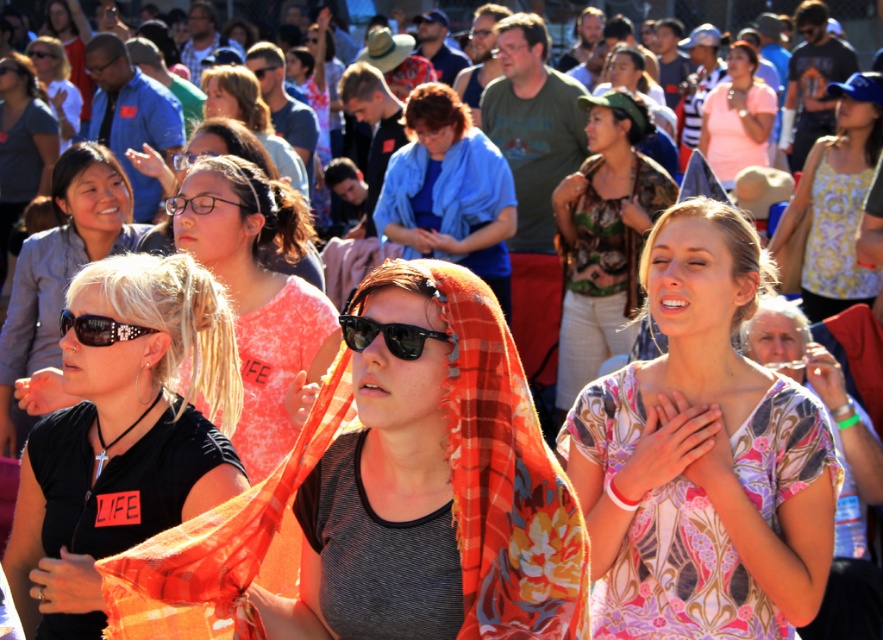
Is pink fabric headscarf at center closer to camera compared to black plastic sunglasses at left?

No, pink fabric headscarf at center is behind black plastic sunglasses at left.

Identify the location of pink fabric headscarf at center. This screenshot has height=640, width=883. (736, 116).

At what (x,y) coordinates should I click in order to perform the action: click on pink fabric headscarf at center. Please return your answer as a coordinate pair (x, y). Image resolution: width=883 pixels, height=640 pixels. Looking at the image, I should click on (736, 116).

Is pink fabric scarf at center bigger than black plastic sunglasses at center?

Yes, pink fabric scarf at center is bigger than black plastic sunglasses at center.

Is point (263, 232) positioned behind point (391, 342)?

That is True.

The image size is (883, 640). In order to click on pink fabric scarf at center in this screenshot , I will do `click(259, 296)`.

Does black matte tank top at center appear on the left side of blue cotton shirt at center?

Yes, black matte tank top at center is to the left of blue cotton shirt at center.

Where is `black matte tank top at center`? This screenshot has height=640, width=883. black matte tank top at center is located at coordinates (126, 433).

Does point (123, 460) come farther from viewer compared to point (406, 253)?

No, it is in front of (406, 253).

I want to click on black matte tank top at center, so click(126, 433).